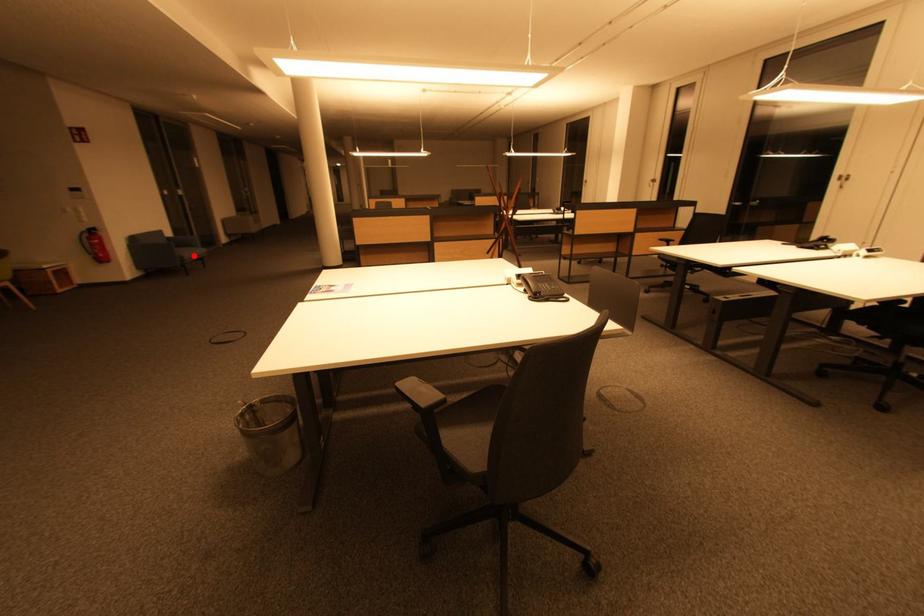
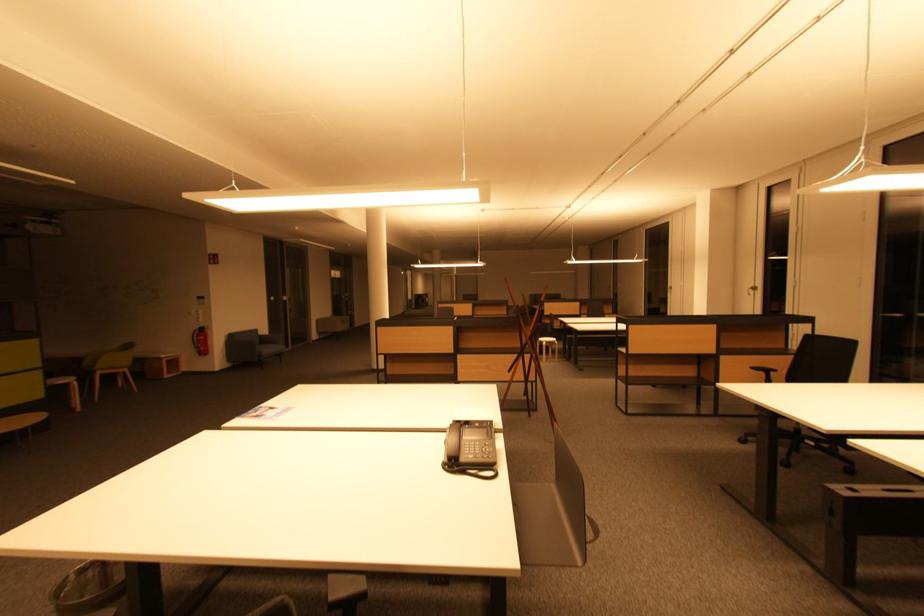
Question: I am providing you with two images of the same scene from different viewpoints. Image1 has a red point marked. In image2, the corresponding 3D location appears at what relative position? Reply with the corresponding letter.

Choices:
 (A) Closer
 (B) Farther

Answer: (A)